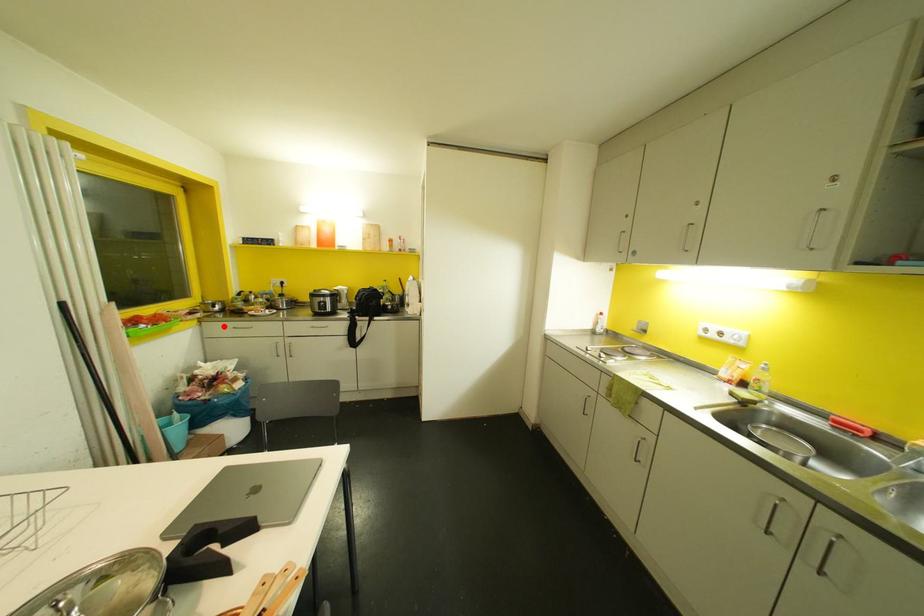
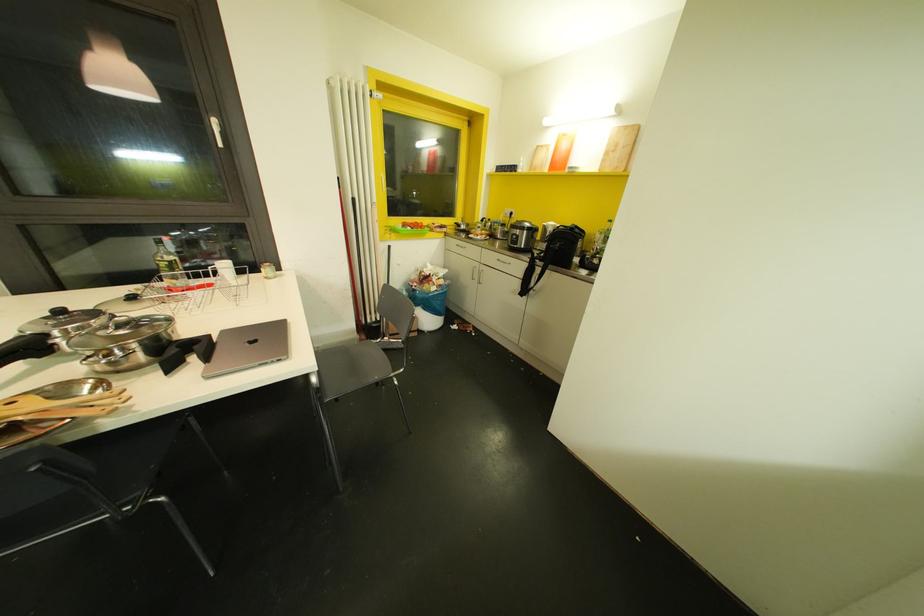
The point at the highlighted location is marked in the first image. Where is the corresponding point in the second image?

(453, 243)